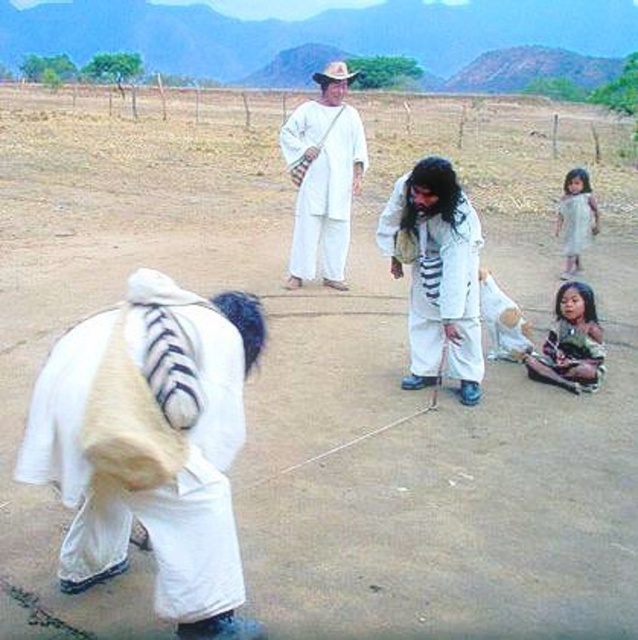
Does white cotton shirt at center appear on the right side of white cotton dress at right?

Incorrect, white cotton shirt at center is not on the right side of white cotton dress at right.

Identify the location of white cotton shirt at center. The width and height of the screenshot is (638, 640). (323, 177).

Locate an element on the screen. This screenshot has height=640, width=638. white cotton shirt at center is located at coordinates 323,177.

Is white fur bag at center to the left of white cotton dress at right from the viewer's perspective?

Yes, white fur bag at center is to the left of white cotton dress at right.

Does white fur bag at center have a lesser height compared to white cotton dress at right?

No, white fur bag at center is not shorter than white cotton dress at right.

Measure the distance between point [41,372] and camera.

Point [41,372] is 9.34 feet away from camera.

In order to click on white fur bag at center in this screenshot , I will do `click(154, 488)`.

From the picture: Is white cotton shirt at center shorter than white cotton dress at lower right?

In fact, white cotton shirt at center may be taller than white cotton dress at lower right.

Between white cotton shirt at center and white cotton dress at lower right, which one is positioned higher?

white cotton shirt at center is higher up.

Which is in front, point (295, 253) or point (565, 257)?

Positioned in front is point (295, 253).

This screenshot has width=638, height=640. I want to click on white cotton shirt at center, so click(x=323, y=177).